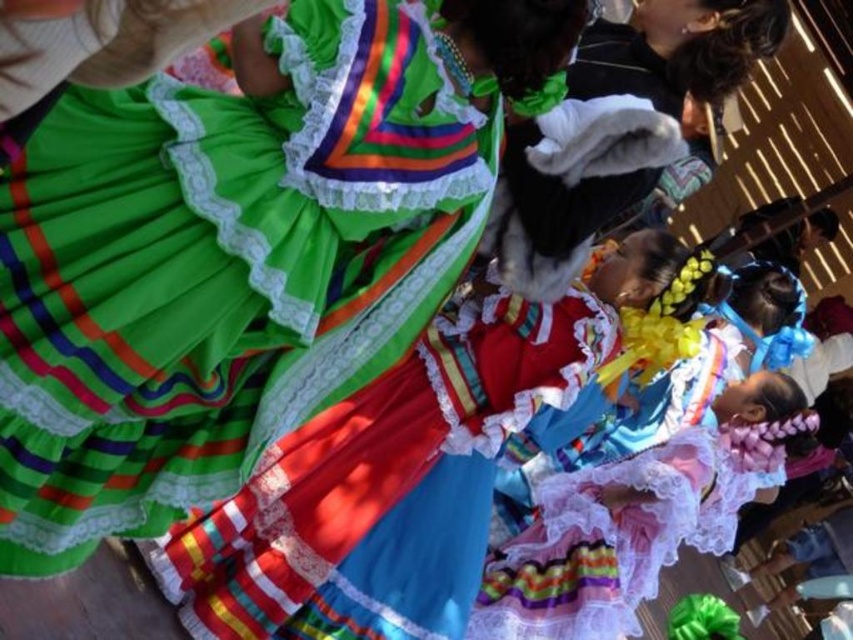
Question: Which point is closer to the camera?

Choices:
 (A) pastel lace dress at center
 (B) white fur hat at upper right
 (C) matte green fabric dress at center

Answer: (C)

Question: Based on their relative distances, which object is nearer to the matte green fabric dress at center?

Choices:
 (A) white fur hat at upper right
 (B) pastel lace dress at center

Answer: (A)

Question: Does matte green fabric dress at center have a lesser width compared to white fur hat at upper right?

Choices:
 (A) no
 (B) yes

Answer: (A)

Question: Does matte green fabric dress at center appear on the left side of pastel lace dress at center?

Choices:
 (A) no
 (B) yes

Answer: (B)

Question: Can you confirm if matte green fabric dress at center is thinner than pastel lace dress at center?

Choices:
 (A) yes
 (B) no

Answer: (A)

Question: Which point is farther to the camera?

Choices:
 (A) pastel lace dress at center
 (B) white fur hat at upper right

Answer: (A)